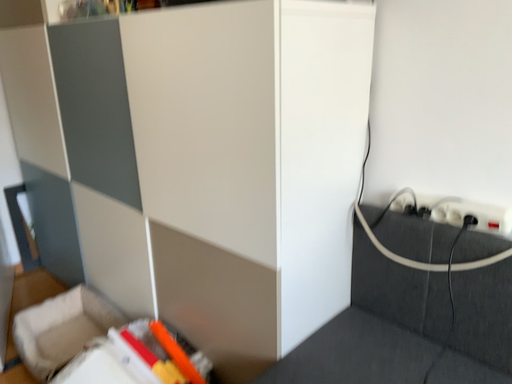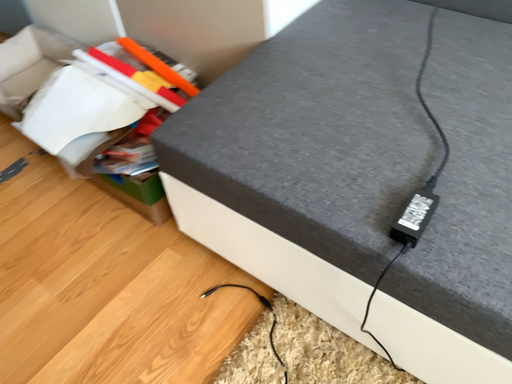
Question: Which way did the camera rotate in the video?

Choices:
 (A) rotated upward
 (B) rotated downward

Answer: (B)